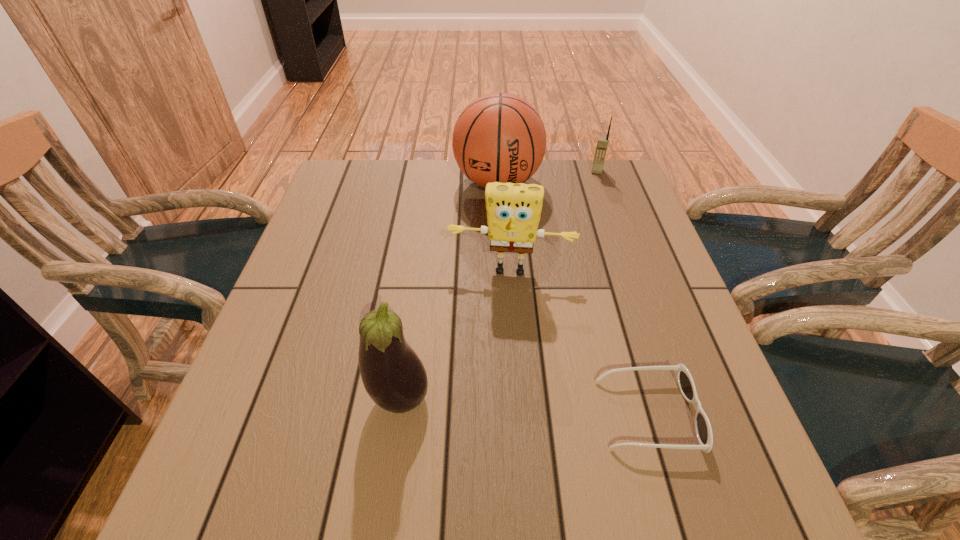
Identify the location of free space located on the front of the second shortest object, where the keypad is located. The image size is (960, 540). (592, 197).

At what (x,y) coordinates should I click in order to perform the action: click on vacant space located on the front of the second shortest object, where the keypad is located. Please return your answer as a coordinate pair (x, y). The width and height of the screenshot is (960, 540). Looking at the image, I should click on (588, 213).

At what (x,y) coordinates should I click in order to perform the action: click on vacant space situated on the front of the second shortest object, where the keypad is located. Please return your answer as a coordinate pair (x, y). Looking at the image, I should click on (590, 205).

Where is `vacant space located on the surface of the basketball near the brand logo`? vacant space located on the surface of the basketball near the brand logo is located at coordinates (494, 269).

What are the coordinates of `vacant point located on the surface of the basketball near the brand logo` in the screenshot? It's located at (x=492, y=318).

Identify the location of vacant space situated 0.340m on the surface of the basketball near the brand logo. This screenshot has height=540, width=960. (492, 300).

This screenshot has height=540, width=960. Find the location of `cellular telephone present at the far edge`. cellular telephone present at the far edge is located at coordinates (602, 144).

You are a GUI agent. You are given a task and a screenshot of the screen. Output one action in this format:
    pyautogui.click(x=<x>, y=<y>)
    Task: Click on the basketball that is at the far edge
    The image size is (960, 540).
    Given the screenshot: What is the action you would take?
    pyautogui.click(x=499, y=137)

Find the location of `eggplant that is at the near edge`. eggplant that is at the near edge is located at coordinates (393, 375).

The height and width of the screenshot is (540, 960). What are the coordinates of `sunglasses that is at the near edge` in the screenshot? It's located at (685, 382).